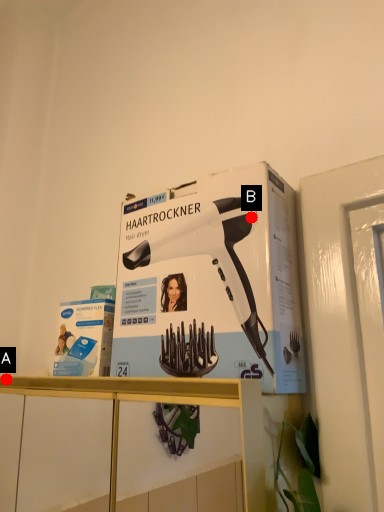
Question: Two points are circled on the image, labeled by A and B beside each circle. Which point appears closest to the camera in this image?

Choices:
 (A) A is closer
 (B) B is closer

Answer: (B)